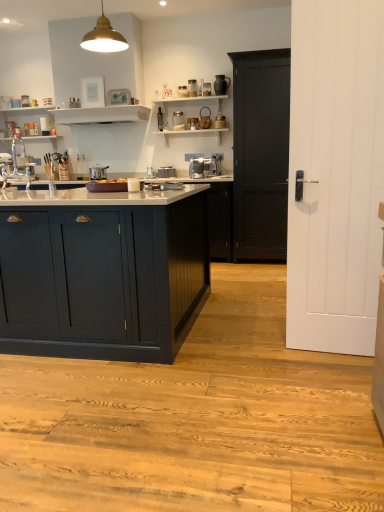
Question: Does satin silver coffee machine at center have a larger size compared to metallic gold pendant light at upper center?

Choices:
 (A) yes
 (B) no

Answer: (B)

Question: Is satin silver coffee machine at center smaller than metallic gold pendant light at upper center?

Choices:
 (A) yes
 (B) no

Answer: (A)

Question: Is satin silver coffee machine at center positioned behind metallic gold pendant light at upper center?

Choices:
 (A) no
 (B) yes

Answer: (B)

Question: From the image's perspective, is satin silver coffee machine at center beneath metallic gold pendant light at upper center?

Choices:
 (A) yes
 (B) no

Answer: (A)

Question: Can you confirm if satin silver coffee machine at center is wider than metallic gold pendant light at upper center?

Choices:
 (A) no
 (B) yes

Answer: (A)

Question: From the image's perspective, is satin silver coffee machine at center above metallic gold pendant light at upper center?

Choices:
 (A) yes
 (B) no

Answer: (B)

Question: Is satin silver coffee machine at center shorter than white glossy shelf at upper center, arranged as the 1th shelf when viewed from the right?

Choices:
 (A) no
 (B) yes

Answer: (A)

Question: From a real-world perspective, is satin silver coffee machine at center located higher than white glossy shelf at upper center, arranged as the 1th shelf when viewed from the right?

Choices:
 (A) no
 (B) yes

Answer: (A)

Question: Would you say satin silver coffee machine at center contains white glossy shelf at upper center, arranged as the 1th shelf when viewed from the right?

Choices:
 (A) yes
 (B) no

Answer: (B)

Question: Is white glossy shelf at upper center, arranged as the 1th shelf when viewed from the right, at the back of satin silver coffee machine at center?

Choices:
 (A) no
 (B) yes

Answer: (A)

Question: From the image's perspective, would you say satin silver coffee machine at center is shown under white glossy shelf at upper center, arranged as the 1th shelf when viewed from the right?

Choices:
 (A) yes
 (B) no

Answer: (A)

Question: Is the position of satin silver coffee machine at center less distant than that of white glossy shelf at upper center, arranged as the 1th shelf when viewed from the right?

Choices:
 (A) no
 (B) yes

Answer: (A)

Question: Considering the relative sizes of white glossy sink at left and satin silver pot at center, which ranks as the 2th appliance in right-to-left order, in the image provided, is white glossy sink at left bigger than satin silver pot at center, which ranks as the 2th appliance in right-to-left order,?

Choices:
 (A) yes
 (B) no

Answer: (A)